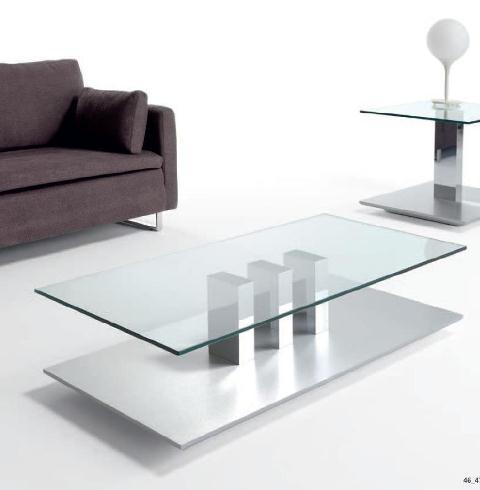
Identify the location of pillow. The height and width of the screenshot is (490, 480). (116, 129).